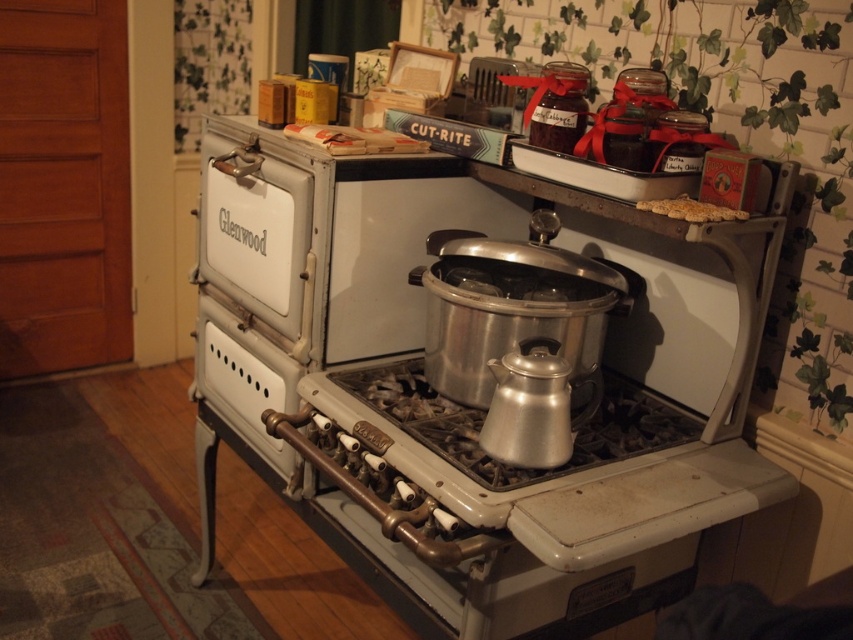
You are standing in front of the vintage Glenwood woodburning stove in the kitchen. You need to place a new pot on the stove top. Where exactly should you place it to ensure it fits properly on the silver metallic oven at center?

The silver metallic oven at center is located at point (474,378), so you should place the new pot at that coordinate to ensure it fits properly on the silver metallic oven at center.